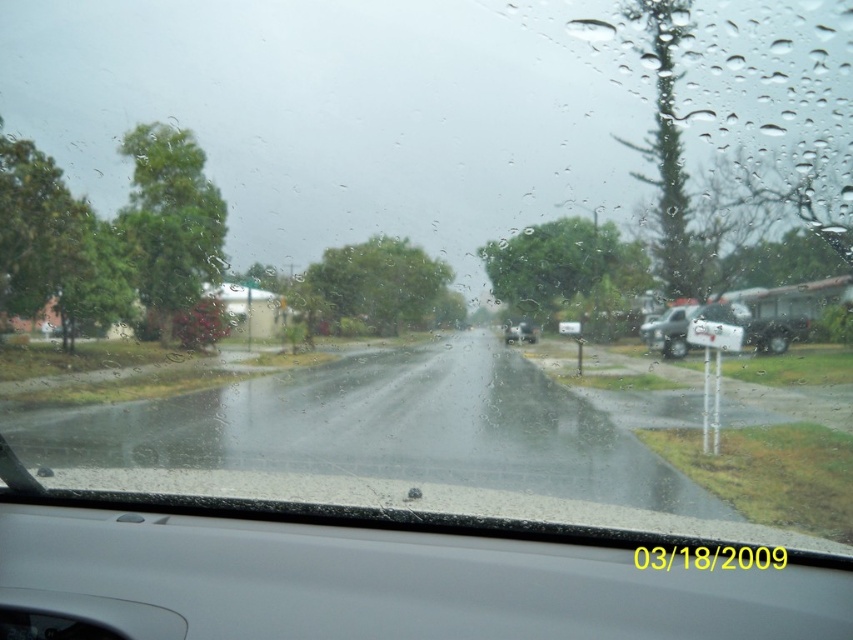
Does gray matte dashboard at center appear on the right side of metallic silver sedan at center?

In fact, gray matte dashboard at center is to the left of metallic silver sedan at center.

Image resolution: width=853 pixels, height=640 pixels. What do you see at coordinates (384, 582) in the screenshot?
I see `gray matte dashboard at center` at bounding box center [384, 582].

The height and width of the screenshot is (640, 853). In order to click on gray matte dashboard at center in this screenshot , I will do `click(384, 582)`.

Which is more to the left, white matte truck at right or metallic silver sedan at center?

From the viewer's perspective, metallic silver sedan at center appears more on the left side.

This screenshot has width=853, height=640. Find the location of `white matte truck at right`. white matte truck at right is located at coordinates (688, 324).

Who is more forward, (670, 324) or (506, 340)?

Point (670, 324)

You are a GUI agent. You are given a task and a screenshot of the screen. Output one action in this format:
    pyautogui.click(x=<x>, y=<y>)
    Task: Click on the white matte truck at right
    The width and height of the screenshot is (853, 640).
    Given the screenshot: What is the action you would take?
    pyautogui.click(x=688, y=324)

Is gray matte dashboard at center to the right of white matte truck at right from the viewer's perspective?

No, gray matte dashboard at center is not to the right of white matte truck at right.

Which is more to the right, gray matte dashboard at center or white matte truck at right?

white matte truck at right is more to the right.

The width and height of the screenshot is (853, 640). In order to click on gray matte dashboard at center in this screenshot , I will do `click(384, 582)`.